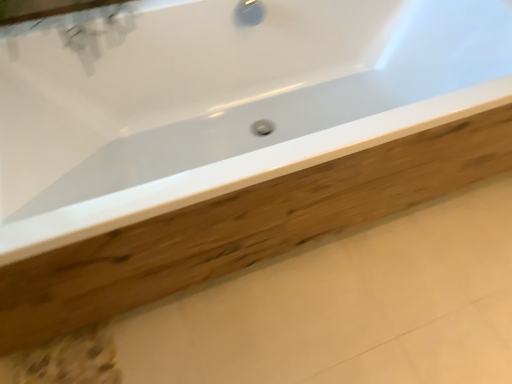
This screenshot has width=512, height=384. I want to click on blank space situated above wooden plank at center (from a real-world perspective), so click(x=306, y=307).